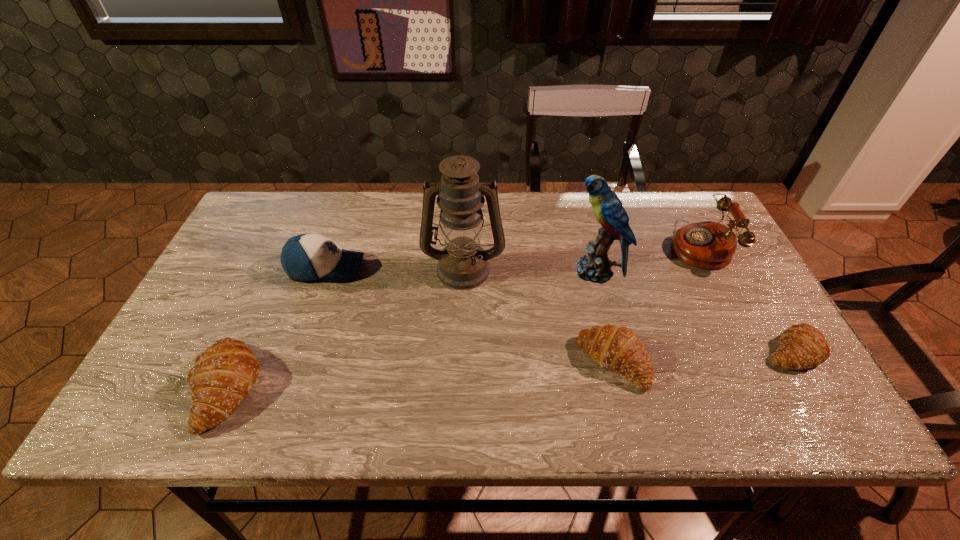
I want to click on object at the far edge, so click(708, 245).

Where is `object that is at the left edge`? This screenshot has height=540, width=960. object that is at the left edge is located at coordinates (222, 376).

Find the location of a particular element. crescent roll located at the right edge is located at coordinates (802, 346).

The height and width of the screenshot is (540, 960). Find the location of `telephone that is at the right edge`. telephone that is at the right edge is located at coordinates tap(708, 245).

In order to click on object located in the near left corner section of the desktop in this screenshot , I will do `click(222, 376)`.

Identify the location of object that is positioned at the far right corner. (708, 245).

The image size is (960, 540). I want to click on object that is at the near right corner, so click(x=802, y=346).

Find the location of a particular element. This screenshot has width=960, height=540. vacant space at the far edge of the desktop is located at coordinates (308, 225).

Image resolution: width=960 pixels, height=540 pixels. I want to click on free space at the near edge of the desktop, so click(484, 379).

In the image, there is a desktop. In order to click on free region at the left edge in this screenshot , I will do `click(245, 278)`.